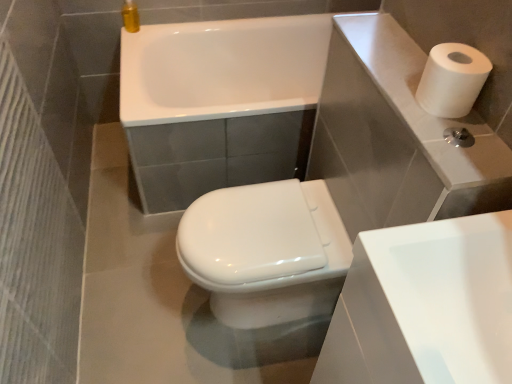
Where is `blank space to the left of white matte paper towel at upper right`? Image resolution: width=512 pixels, height=384 pixels. blank space to the left of white matte paper towel at upper right is located at coordinates (394, 96).